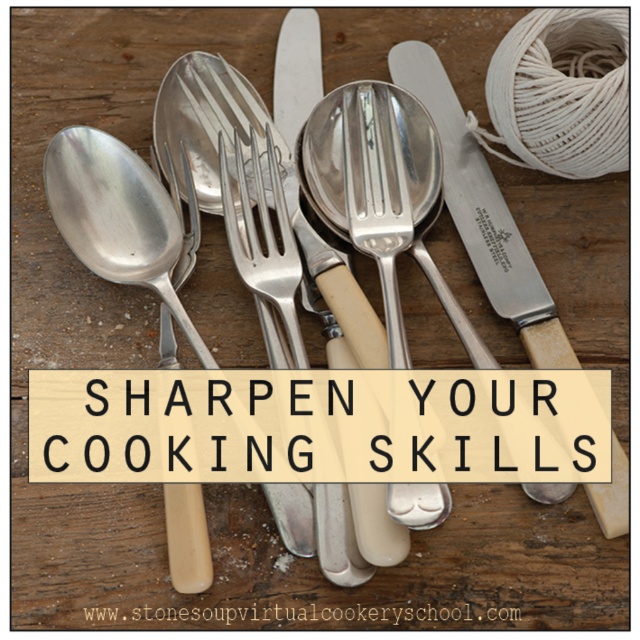
You are setting the table and need to choose between the silver metallic spoon at upper center and the silver metallic fork at center. Which one is taller?

The silver metallic spoon at upper center is much taller than the silver metallic fork at center.

You are setting the table and need to choose between the brushed metal spoon at left and the shiny silver spoon at center. Which spoon is taller?

The brushed metal spoon at left is taller than the shiny silver spoon at center.